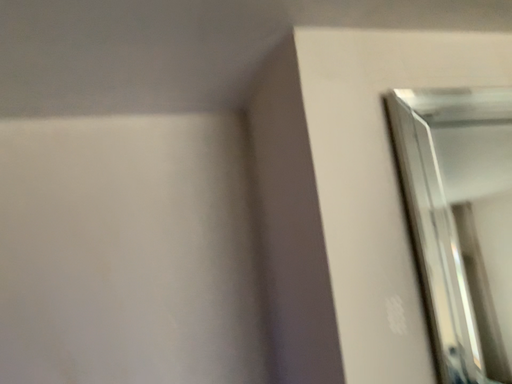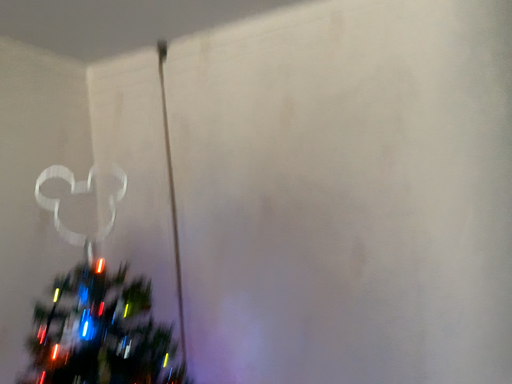
Question: Which way did the camera rotate in the video?

Choices:
 (A) rotated right
 (B) rotated left

Answer: (B)